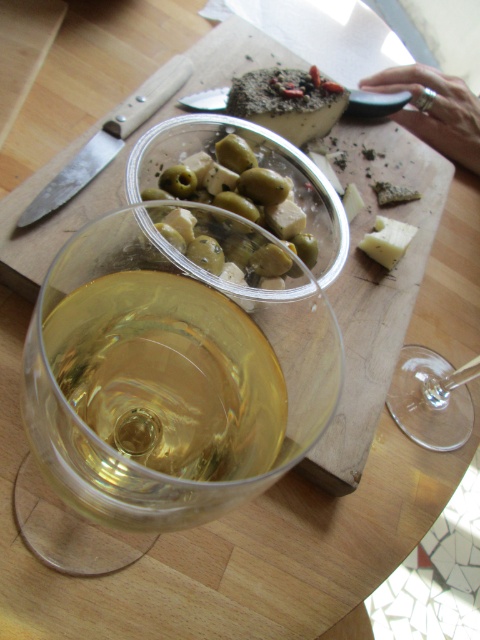
Does green olive at center have a smaller size compared to transparent glass at lower right?

Actually, green olive at center might be larger than transparent glass at lower right.

Is green olive at center taller than transparent glass at lower right?

Correct, green olive at center is much taller as transparent glass at lower right.

Is point (278, 221) farther from viewer compared to point (433, 426)?

No, (278, 221) is in front of (433, 426).

Locate an element on the screen. The image size is (480, 640). green olive at center is located at coordinates tap(240, 192).

Which of these two, transparent glass wine at center or white crumbly cheese at center-right, stands taller?

transparent glass wine at center

Is transparent glass wine at center behind white crumbly cheese at center-right?

No, transparent glass wine at center is in front of white crumbly cheese at center-right.

Does point (163, 385) lie in front of point (383, 244)?

Yes, it is in front of point (383, 244).

You are a GUI agent. You are given a task and a screenshot of the screen. Output one action in this format:
    pyautogui.click(x=<x>, y=<y>)
    Task: Click on the transparent glass wine at center
    This screenshot has height=640, width=480.
    Given the screenshot: What is the action you would take?
    pyautogui.click(x=176, y=365)

Consider the image. Is silver ring at upper right further to the viewer compared to crumbly cheese at center?

Yes, silver ring at upper right is further from the viewer.

Find the location of a particular element. Image resolution: width=480 pixels, height=640 pixels. silver ring at upper right is located at coordinates click(x=434, y=109).